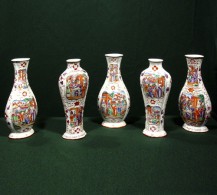
Find the location of `vase`. vase is located at coordinates (23, 105), (75, 96), (110, 94), (153, 94), (195, 98).